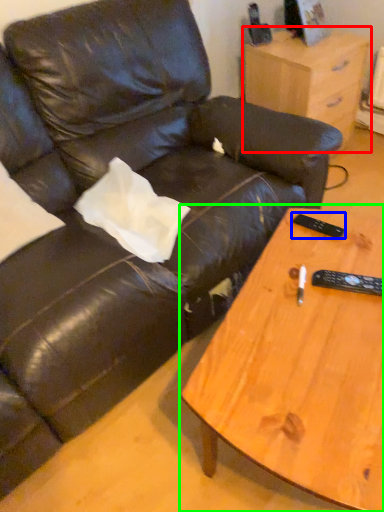
Question: Which object is the farthest from nightstand (highlighted by a red box)? Choose among these: remote (highlighted by a blue box) or coffee table (highlighted by a green box).

Choices:
 (A) remote
 (B) coffee table

Answer: (B)